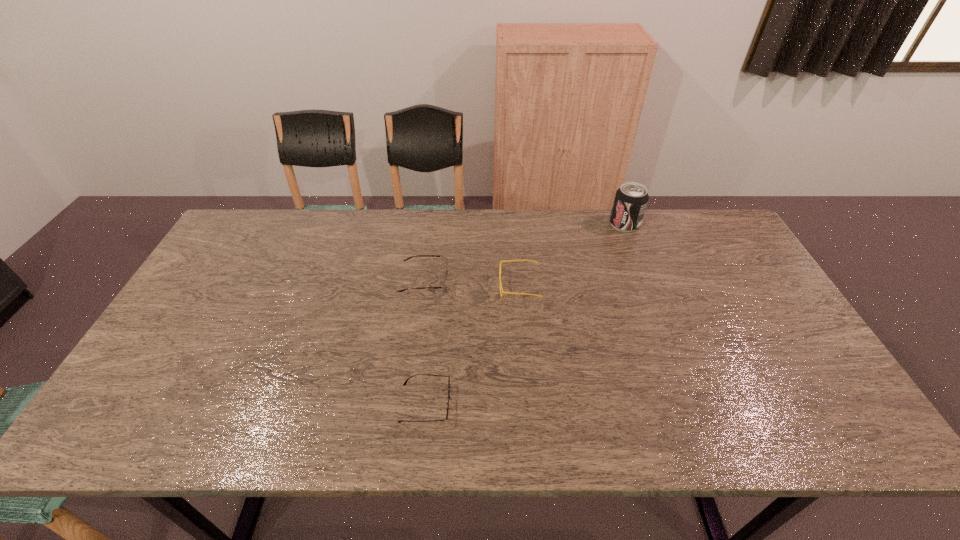
You are a GUI agent. You are given a task and a screenshot of the screen. Output one action in this format:
    pyautogui.click(x=<x>, y=<y>)
    Task: Click on the soda can
    Image resolution: width=960 pixels, height=540 pixels.
    Given the screenshot: What is the action you would take?
    631,199

This screenshot has height=540, width=960. In order to click on the farthest object in this screenshot , I will do `click(631, 199)`.

Identify the location of the rightmost spectacles. (536, 262).

Image resolution: width=960 pixels, height=540 pixels. Identify the location of the shortest object. (447, 402).

What are the coordinates of `the shortest spectacles` in the screenshot? It's located at (447, 402).

Locate an element on the screen. Image resolution: width=960 pixels, height=540 pixels. vacant space located on the front of the tallest object is located at coordinates [x=643, y=272].

Locate an element on the screen. free space located 0.310m in front of the lenses of the rightmost spectacles is located at coordinates (395, 286).

This screenshot has height=540, width=960. I want to click on blank space located 0.260m in front of the lenses of the rightmost spectacles, so click(x=412, y=286).

The width and height of the screenshot is (960, 540). I want to click on vacant space located 0.350m in front of the lenses of the rightmost spectacles, so click(381, 286).

Image resolution: width=960 pixels, height=540 pixels. What are the coordinates of `vacant area situated on the front-facing side of the nearest object` in the screenshot? It's located at (549, 403).